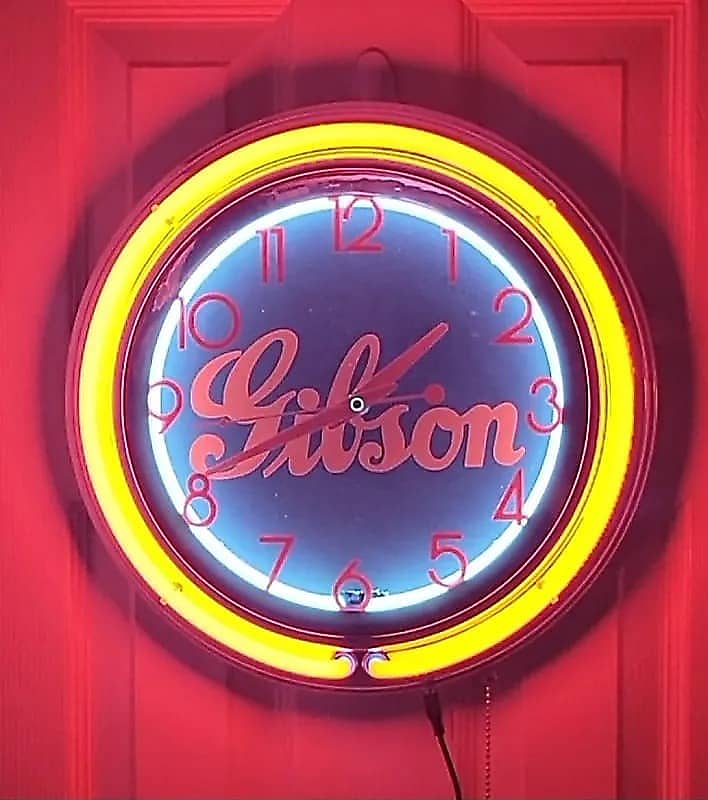
In order to click on white light circle in this screenshot , I will do `click(489, 557)`.